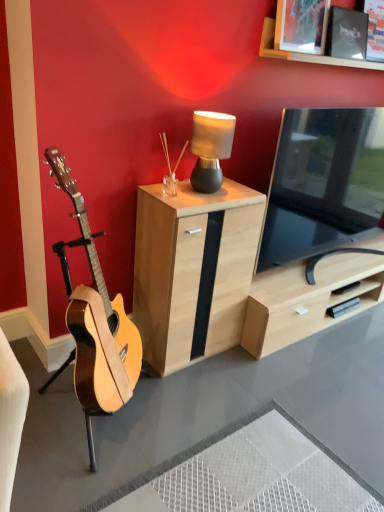
Where is `vacant space in front of matte black lamp at center`? The height and width of the screenshot is (512, 384). vacant space in front of matte black lamp at center is located at coordinates tap(204, 198).